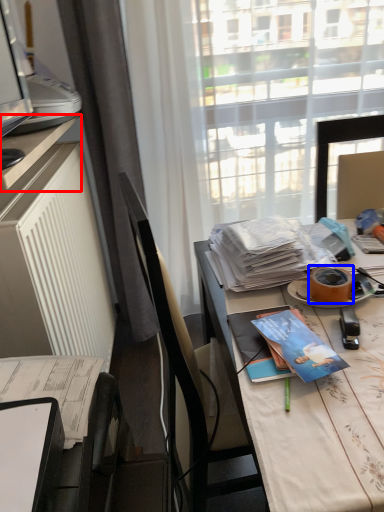
Question: Which object is closer to the camera taking this photo, desk (highlighted by a red box) or adhesive tape (highlighted by a blue box)?

Choices:
 (A) desk
 (B) adhesive tape

Answer: (A)